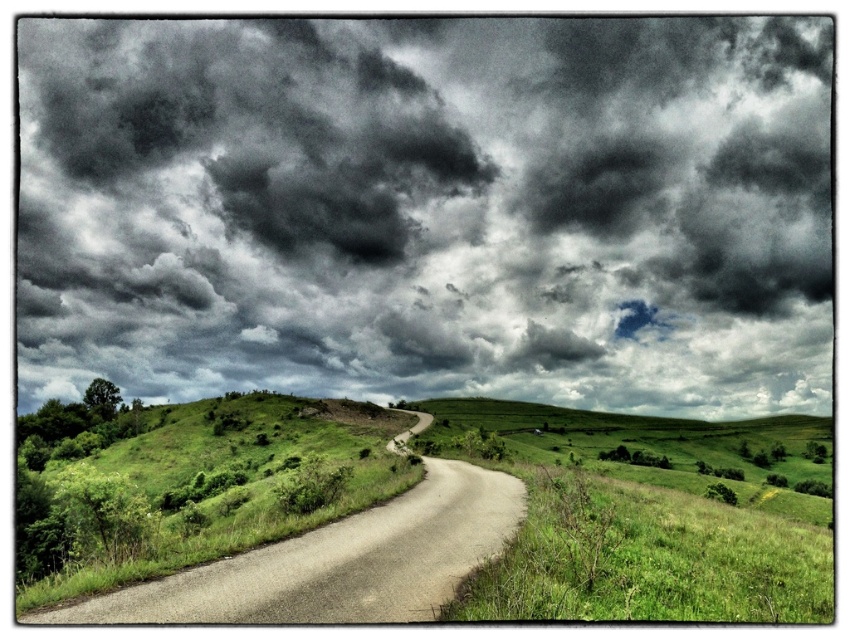
Which is more to the right, green grassy at lower right or smooth asphalt road at center?

Positioned to the right is green grassy at lower right.

Is green grassy at lower right shorter than smooth asphalt road at center?

Incorrect, green grassy at lower right's height does not fall short of smooth asphalt road at center's.

Is point (581, 536) positioned before point (112, 605)?

No.

What are the coordinates of `green grassy at lower right` in the screenshot? It's located at (647, 557).

Can you confirm if dark textured clouds at upper center is positioned to the left of smooth asphalt road at center?

No, dark textured clouds at upper center is not to the left of smooth asphalt road at center.

What do you see at coordinates (429, 209) in the screenshot? This screenshot has width=850, height=640. I see `dark textured clouds at upper center` at bounding box center [429, 209].

Who is more forward, (x=77, y=68) or (x=167, y=579)?

Point (x=167, y=579)

Identify the location of dark textured clouds at upper center. (429, 209).

Does dark textured clouds at upper center have a lesser width compared to green grassy at lower right?

In fact, dark textured clouds at upper center might be wider than green grassy at lower right.

Identify the location of dark textured clouds at upper center. The image size is (850, 640). (429, 209).

What do you see at coordinates (429, 209) in the screenshot? This screenshot has width=850, height=640. I see `dark textured clouds at upper center` at bounding box center [429, 209].

The image size is (850, 640). Find the location of `dark textured clouds at upper center`. dark textured clouds at upper center is located at coordinates (429, 209).